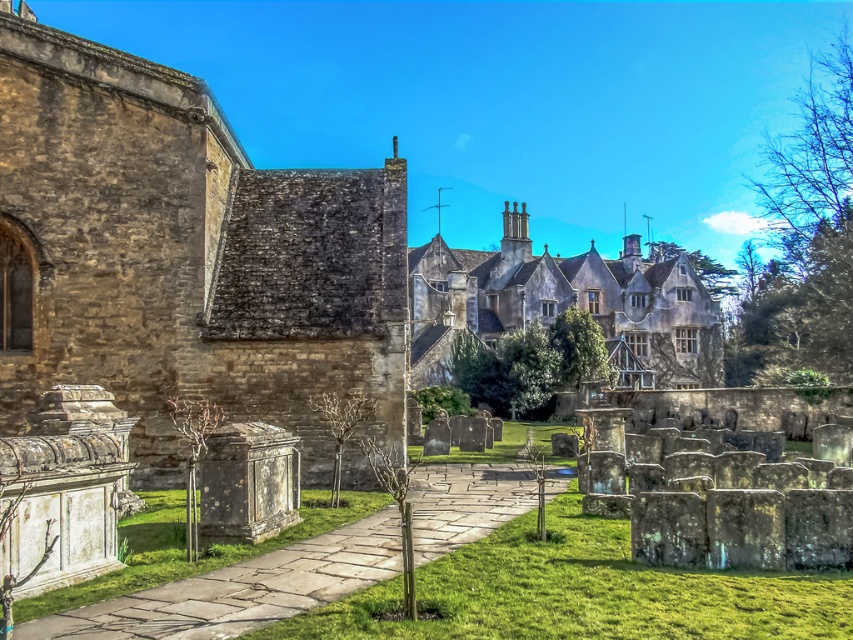
You are a gardener with a lawnmower that is 1.5 meters wide. You need to mow the green grass at lower left but there is a smooth gray stone gravestone at lower left in the way. Can your lawnmower fit between the two without hitting the gravestone?

The green grass at lower left and smooth gray stone gravestone at lower left are 2.57 meters apart from each other, so yes, the lawnmower can fit between them since it is only 1.5 meters wide.

Looking at this image, you are standing at the entrance of the churchyard and want to walk towards the stone gray stone building at center. Which direction should you turn to avoid the smooth gray stone gravestone at lower left?

You should turn to the right to head towards the stone gray stone building at center since it is located to the right of the smooth gray stone gravestone at lower left.